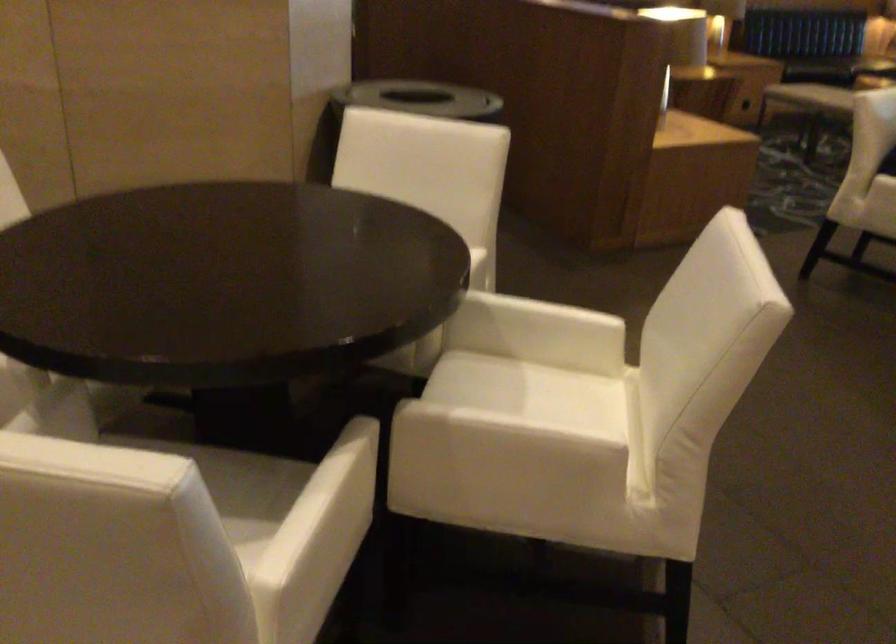
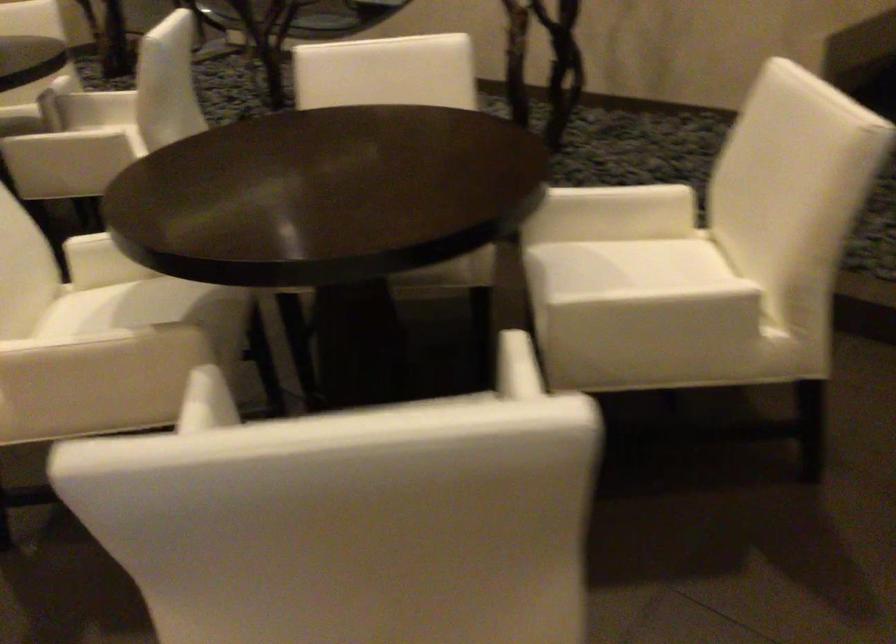
Question: The first image is from the beginning of the video and the second image is from the end. How did the camera likely rotate when shooting the video?

Choices:
 (A) Left
 (B) Right
 (C) Up
 (D) Down

Answer: (A)